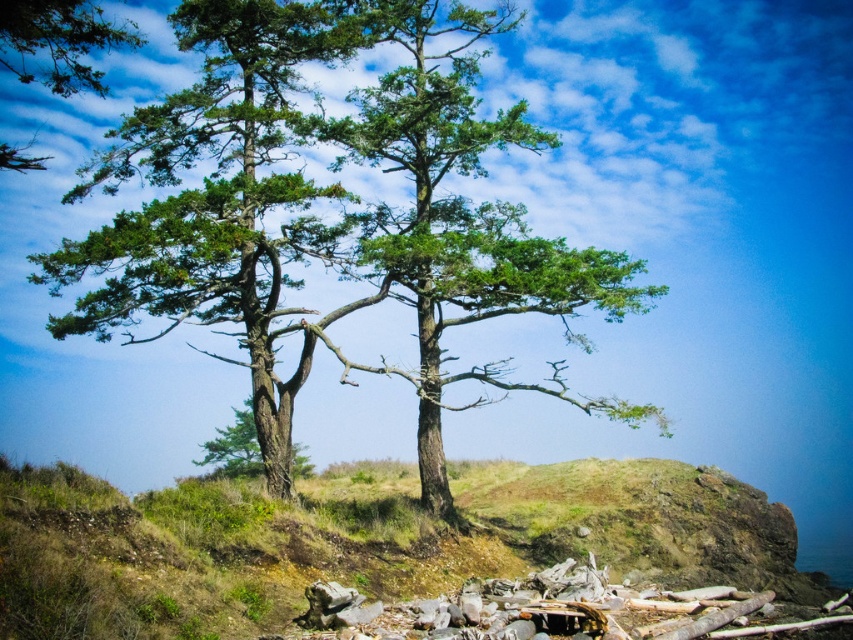
You are a hiker who wants to take a photo of both the green textured tree at center and the green rough bark tree at center. Since you have a camera with a fixed focal length, you need to know which tree is wider to frame your shot properly. Which tree has a greater width?

The green textured tree at center has a greater width than the green rough bark tree at center.

You are standing at the point labeled as point (328, 212) in the image. Looking around, you see two green textured trees at center. Which direction should you walk to reach the nearest tree?

The point labeled as point (328, 212) is exactly where the green textured tree at center is located, so you are already at the tree and do not need to move.

You are a hiker who wants to take a photo of both the green textured tree at center and the green rough bark tree at center. Since you have a camera with a fixed focal length, you need to stand at a position where both trees are fully visible in the frame. Based on their sizes, which tree should you position closer to the camera to ensure both are in the shot?

The green textured tree at center is larger than the green rough bark tree at center. To capture both trees fully in the frame, you should position the larger green textured tree at center closer to the camera so that its size is balanced with the smaller green rough bark tree at center.